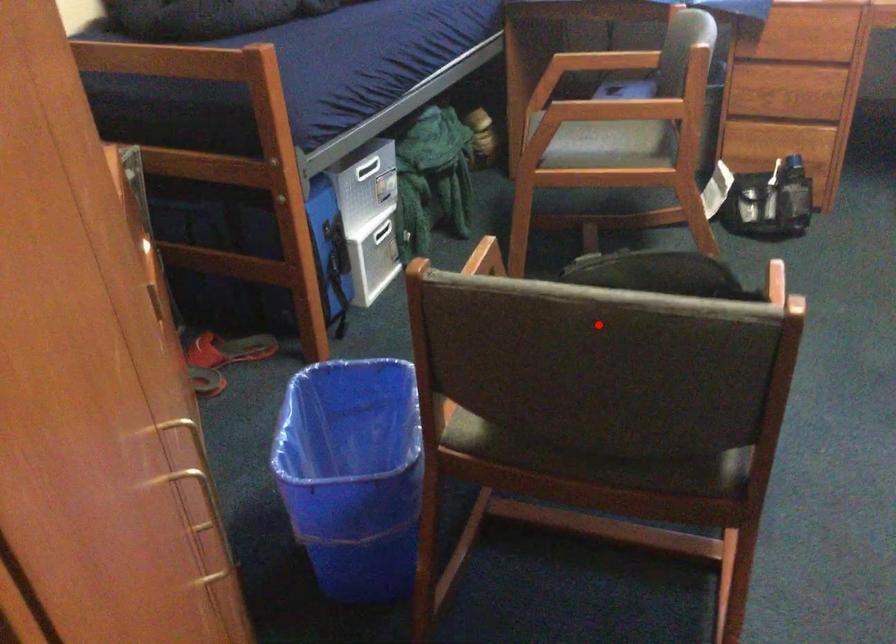
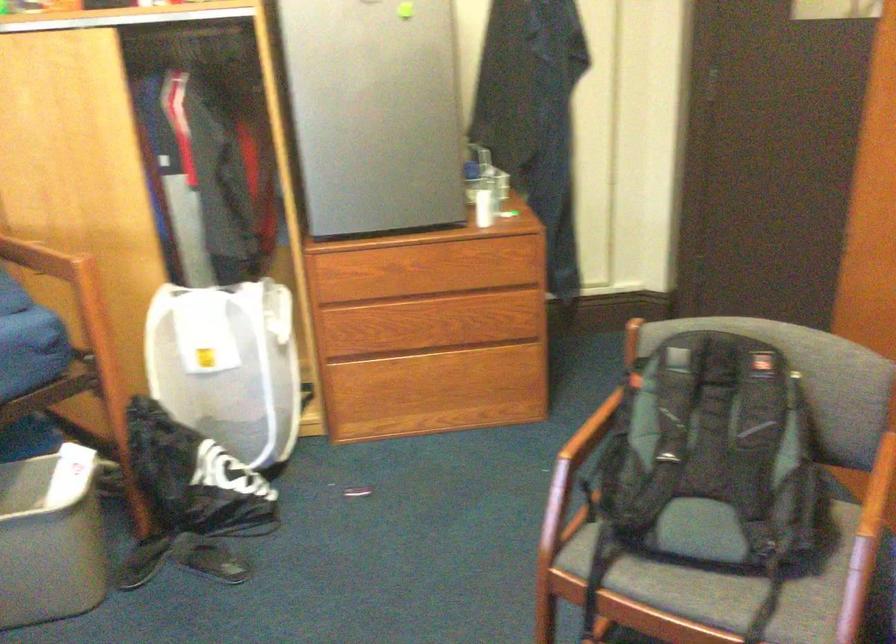
Question: A red point is marked in image1. In image2, is the corresponding 3D point closer to the camera or farther? Reply with the corresponding letter.

Choices:
 (A) The corresponding 3D point is closer.
 (B) The corresponding 3D point is farther.

Answer: (B)